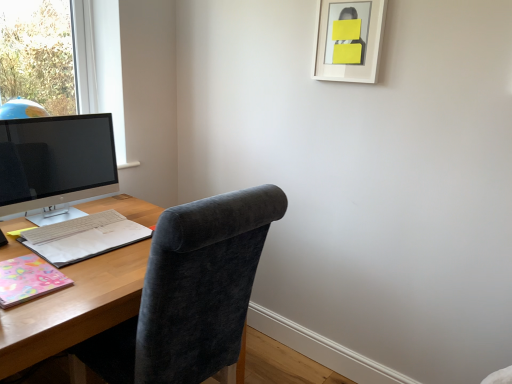
Identify the location of vacant region above wooden desk at center (from a real-world perspective). (88, 258).